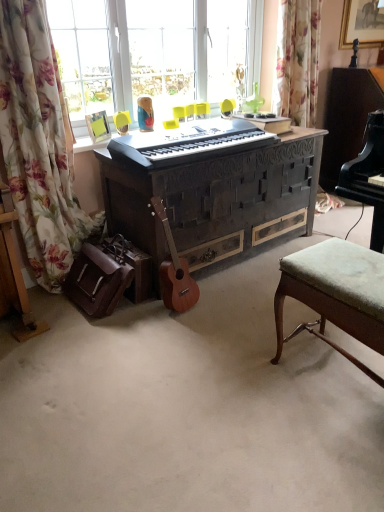
This screenshot has height=512, width=384. Find the location of `vacant region in front of dark wood carved desk at center`. vacant region in front of dark wood carved desk at center is located at coordinates (185, 349).